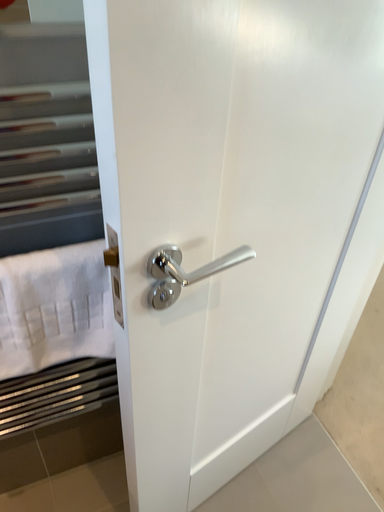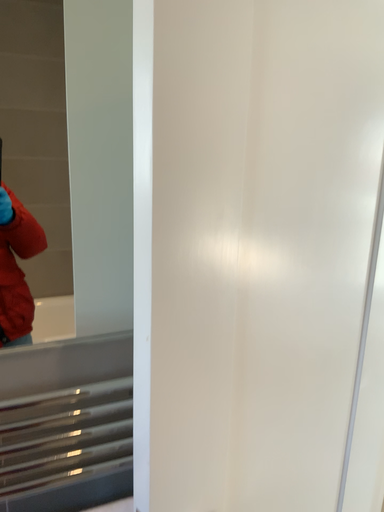
Question: How did the camera likely rotate when shooting the video?

Choices:
 (A) rotated downward
 (B) rotated upward

Answer: (B)